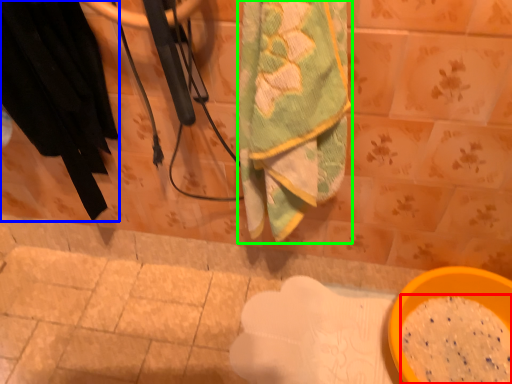
Question: Considering the real-world distances, which object is farthest from powder (highlighted by a red box)? clothing (highlighted by a blue box) or towel (highlighted by a green box)?

Choices:
 (A) clothing
 (B) towel

Answer: (A)